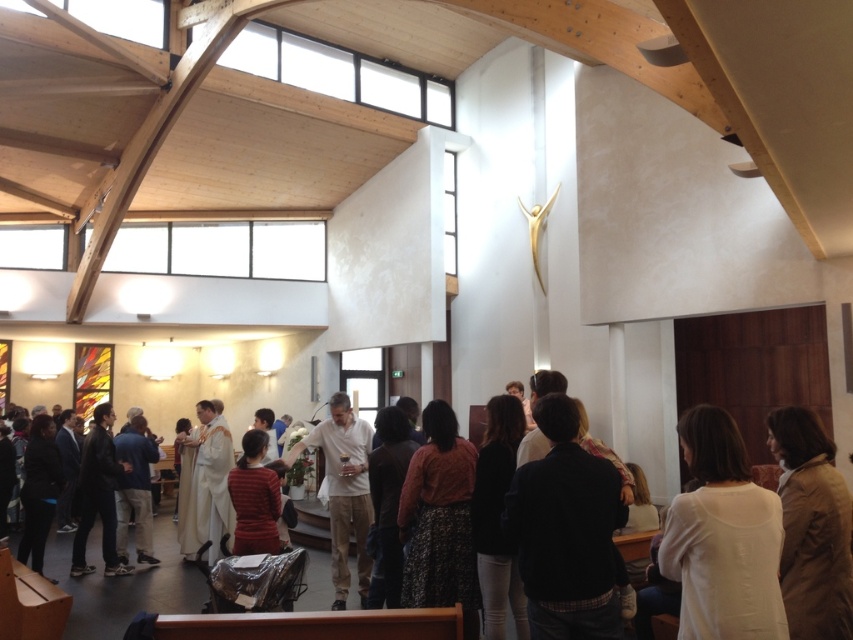
Question: Which of the following is the closest to the observer?

Choices:
 (A) white clothed person at lower left
 (B) light beige cotton shirt at center

Answer: (B)

Question: Which of the following is the closest to the observer?

Choices:
 (A) white matte shirt at center
 (B) white clothed person at lower left

Answer: (A)

Question: Is white matte shirt at center below light beige cotton shirt at center?

Choices:
 (A) no
 (B) yes

Answer: (A)

Question: Can you confirm if white matte shirt at center is positioned above light beige cotton shirt at center?

Choices:
 (A) yes
 (B) no

Answer: (A)

Question: Which of the following is the farthest from the observer?

Choices:
 (A) dark blue sweater at center
 (B) white matte shirt at center

Answer: (A)

Question: Can you confirm if dark blue sweater at center is positioned to the left of white clothed person at lower left?

Choices:
 (A) yes
 (B) no

Answer: (B)